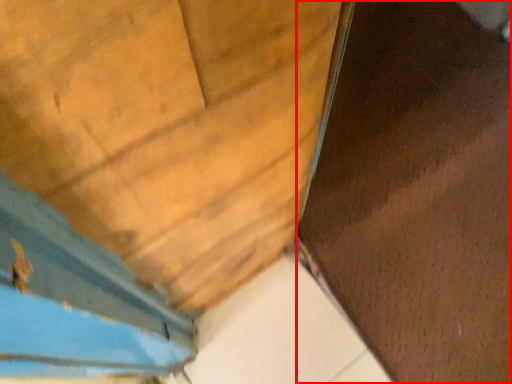
Question: From the image, what is the correct spatial relationship of plywood (annotated by the red box) in relation to door?

Choices:
 (A) right
 (B) left

Answer: (A)